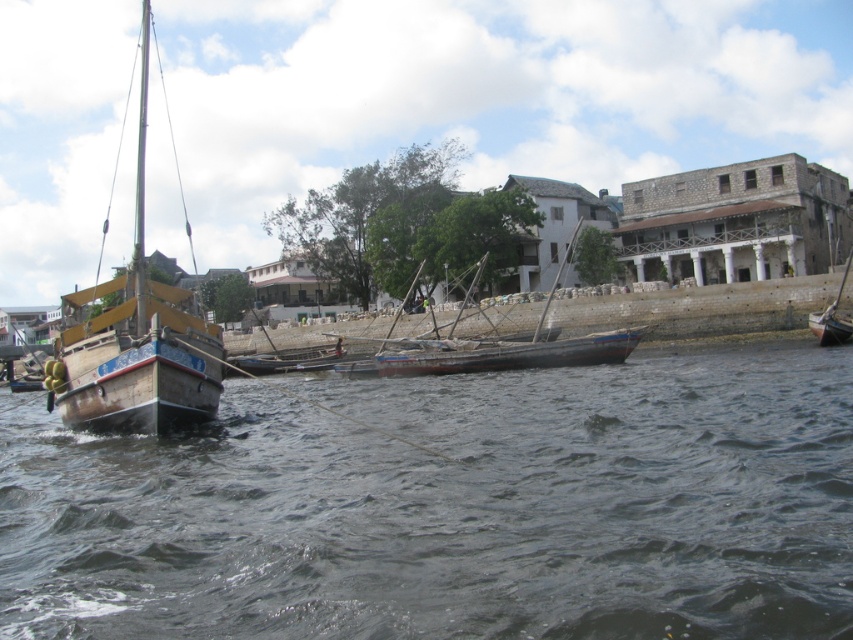
You are a tourist standing on the stone embankment and want to take a photo of the wooden boat at center. To avoid including the dark gray water at center in the background, should you move forward or backward?

The dark gray water at center is positioned under wooden boat at center, so moving forward would bring the wooden boat closer and reduce the visibility of the dark gray water at center in the background. Therefore, move forward.

You are standing on the shore looking at the dark gray water at center and the wooden boat at center. Which object is nearer to you?

The dark gray water at center is closer to the viewer than the wooden boat at center.